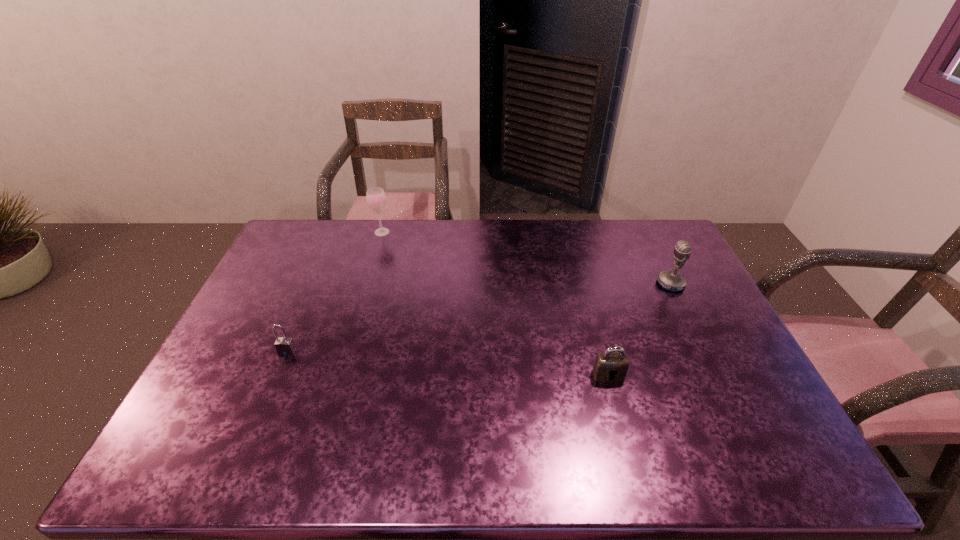
The height and width of the screenshot is (540, 960). Identify the location of wineglass. (376, 198).

Image resolution: width=960 pixels, height=540 pixels. Find the location of `the farthest object`. the farthest object is located at coordinates (376, 198).

Identify the location of microphone. Image resolution: width=960 pixels, height=540 pixels. (x=673, y=281).

Where is `the second farthest object`? the second farthest object is located at coordinates (673, 281).

Where is `the third object from left to right`? the third object from left to right is located at coordinates (610, 366).

At what (x,y) coordinates should I click in order to perform the action: click on the right padlock. Please return your answer as a coordinate pair (x, y). Looking at the image, I should click on (610, 366).

At what (x,y) coordinates should I click in order to perform the action: click on the leftmost object. Please return your answer as a coordinate pair (x, y). Image resolution: width=960 pixels, height=540 pixels. Looking at the image, I should click on (285, 346).

Where is `the left padlock`? The width and height of the screenshot is (960, 540). the left padlock is located at coordinates (285, 346).

Image resolution: width=960 pixels, height=540 pixels. What are the coordinates of `free location located 0.160m on the front of the wineglass` in the screenshot? It's located at (372, 264).

The width and height of the screenshot is (960, 540). In order to click on free space located on the front-facing side of the rightmost object in this screenshot , I will do `click(585, 284)`.